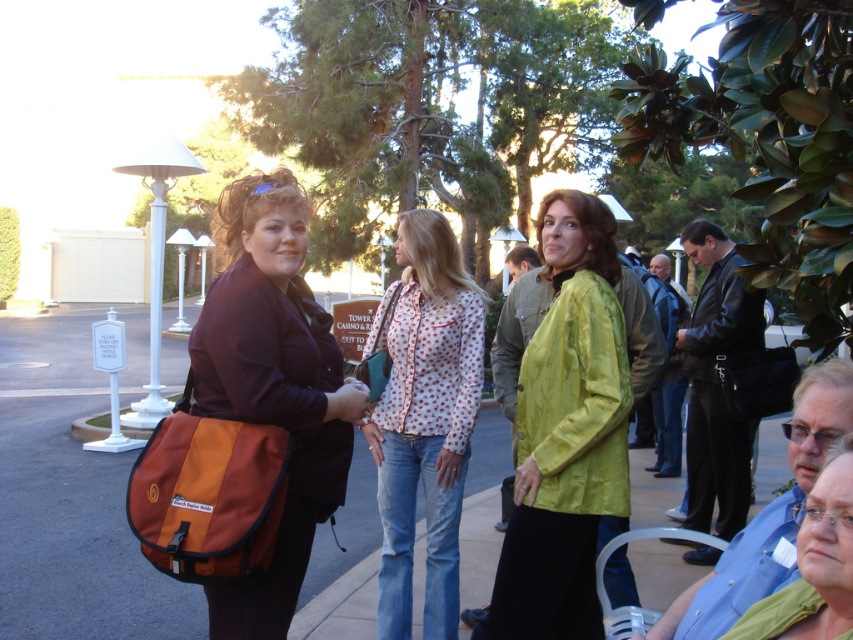
Question: Which point is closer to the camera?

Choices:
 (A) (260, 188)
 (B) (590, 269)
 (C) (428, 353)
 (D) (764, 627)

Answer: (D)

Question: Does printed cotton blouse at center appear under green matte jacket at lower right?

Choices:
 (A) yes
 (B) no

Answer: (B)

Question: Which point appears closest to the camera in this image?

Choices:
 (A) (410, 605)
 (B) (846, 515)
 (C) (331, 417)

Answer: (B)

Question: From the image, what is the correct spatial relationship of matte brown bag at center in relation to printed cotton blouse at center?

Choices:
 (A) right
 (B) left

Answer: (B)

Question: Can you confirm if printed cotton blouse at center is positioned below green matte jacket at lower right?

Choices:
 (A) yes
 (B) no

Answer: (B)

Question: Among these objects, which one is farthest from the camera?

Choices:
 (A) printed cotton blouse at center
 (B) matte brown bag at center

Answer: (A)